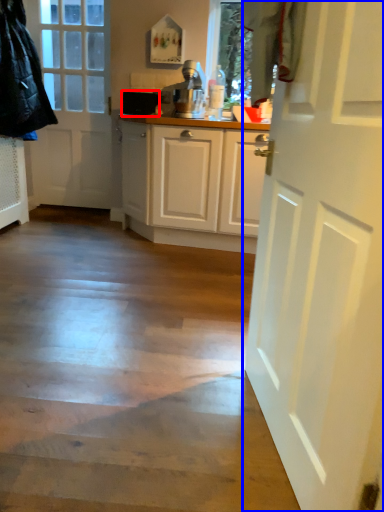
Question: Which object appears closest to the camera in this image, appliance (highlighted by a red box) or door (highlighted by a blue box)?

Choices:
 (A) appliance
 (B) door

Answer: (B)